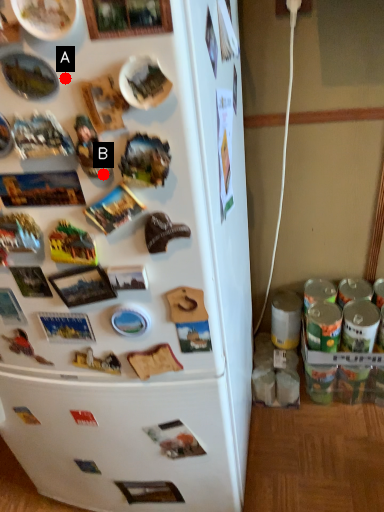
Question: Two points are circled on the image, labeled by A and B beside each circle. Which point is further to the camera?

Choices:
 (A) A is further
 (B) B is further

Answer: (B)